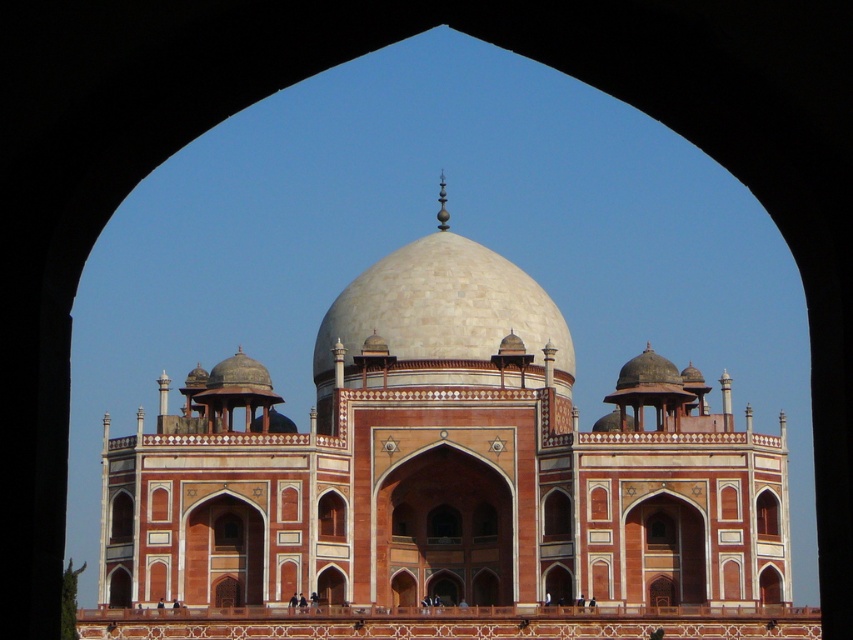
Question: Which of the following is the closest to the observer?

Choices:
 (A) white marble dome at center
 (B) beige stone mosque at center

Answer: (B)

Question: Is beige stone mosque at center bigger than white marble dome at center?

Choices:
 (A) no
 (B) yes

Answer: (B)

Question: Considering the relative positions of beige stone mosque at center and white marble dome at center in the image provided, where is beige stone mosque at center located with respect to white marble dome at center?

Choices:
 (A) above
 (B) below

Answer: (B)

Question: Does beige stone mosque at center appear over white marble dome at center?

Choices:
 (A) yes
 (B) no

Answer: (B)